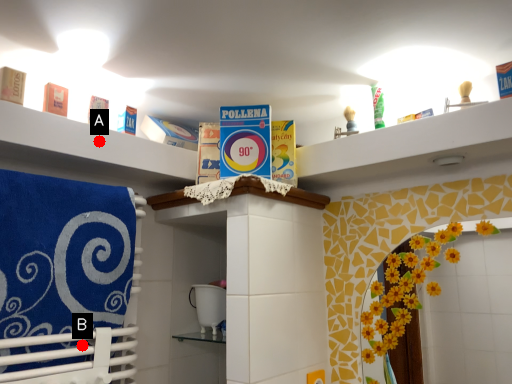
Question: Two points are circled on the image, labeled by A and B beside each circle. Among these points, which one is farthest from the camera?

Choices:
 (A) A is further
 (B) B is further

Answer: (A)